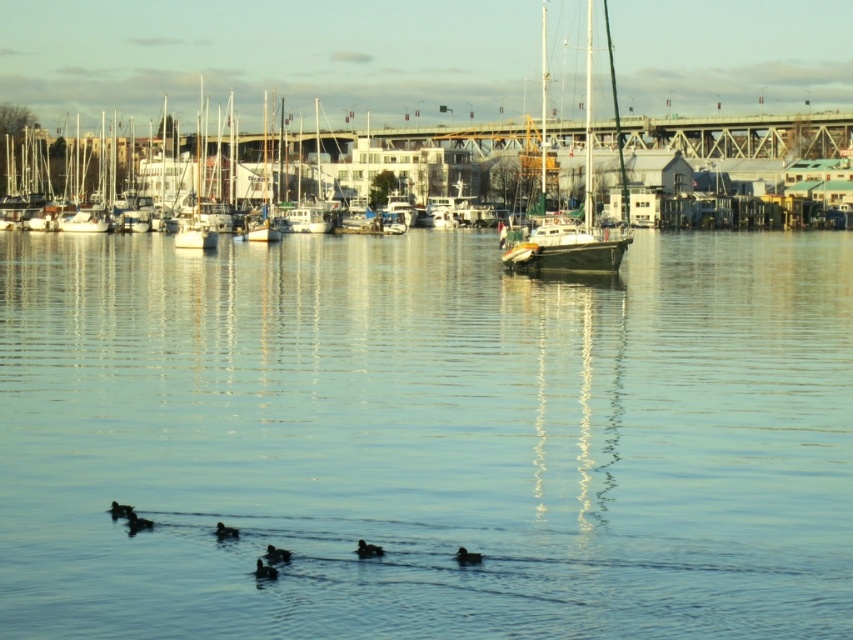
How far apart are clear blue water at center and dark brown feathers at center?

clear blue water at center and dark brown feathers at center are 31.01 meters apart.

Does point (767, 257) come farther from viewer compared to point (370, 552)?

That is True.

Locate an element on the screen. This screenshot has width=853, height=640. clear blue water at center is located at coordinates (426, 436).

Between dark brown feathers at center and dark brown feathers at lower center, which one appears on the left side from the viewer's perspective?

Positioned to the left is dark brown feathers at lower center.

Is dark brown feathers at center positioned in front of dark brown feathers at lower center?

No, it is not.

Is point (363, 550) positioned in front of point (258, 563)?

That is False.

Locate an element on the screen. Image resolution: width=853 pixels, height=640 pixels. dark brown feathers at center is located at coordinates (368, 548).

Is brown matte duck at lower center to the left of dark brown feathers at center from the viewer's perspective?

Yes, brown matte duck at lower center is to the left of dark brown feathers at center.

Is brown matte duck at lower center smaller than dark brown feathers at center?

Yes, brown matte duck at lower center is smaller than dark brown feathers at center.

Locate an element on the screen. The width and height of the screenshot is (853, 640). brown matte duck at lower center is located at coordinates (276, 554).

You are a GUI agent. You are given a task and a screenshot of the screen. Output one action in this format:
    pyautogui.click(x=<x>, y=<y>)
    Task: Click on the brown matte duck at lower center
    The width and height of the screenshot is (853, 640).
    Given the screenshot: What is the action you would take?
    pyautogui.click(x=276, y=554)